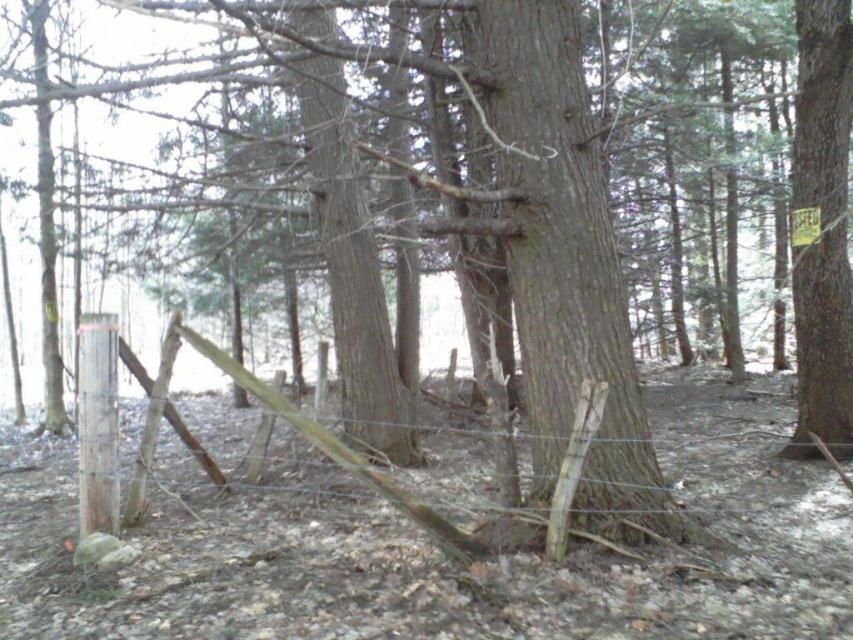
Question: Which object appears farthest from the camera in this image?

Choices:
 (A) wooden fence at center
 (B) smooth brown tree trunk at right

Answer: (B)

Question: Is smooth brown tree trunk at right closer to the viewer compared to wooden fence at center?

Choices:
 (A) no
 (B) yes

Answer: (A)

Question: Is smooth brown tree trunk at right behind wooden fence at center?

Choices:
 (A) yes
 (B) no

Answer: (A)

Question: Which object appears farthest from the camera in this image?

Choices:
 (A) smooth brown tree trunk at right
 (B) wooden fence at center

Answer: (A)

Question: Is smooth brown tree trunk at right to the right of wooden fence at center from the viewer's perspective?

Choices:
 (A) yes
 (B) no

Answer: (A)